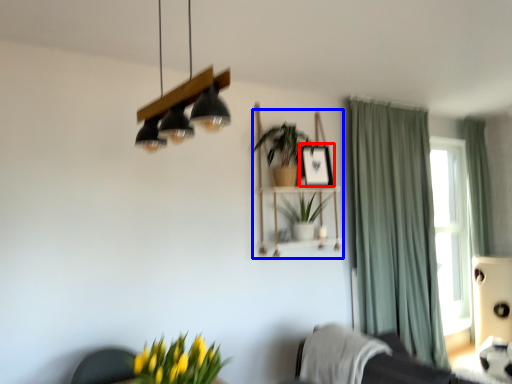
Question: Which of the following is the farthest to the observer, picture frame (highlighted by a red box) or shelf (highlighted by a blue box)?

Choices:
 (A) picture frame
 (B) shelf

Answer: (A)